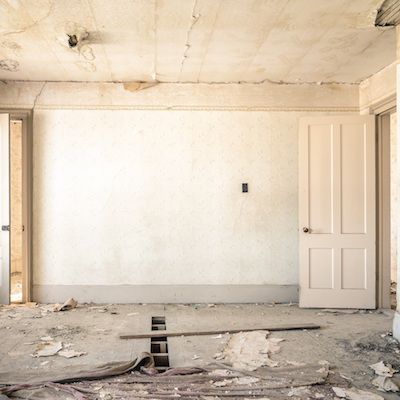
Where is `rags`? This screenshot has height=400, width=400. rags is located at coordinates (306, 386), (113, 384).